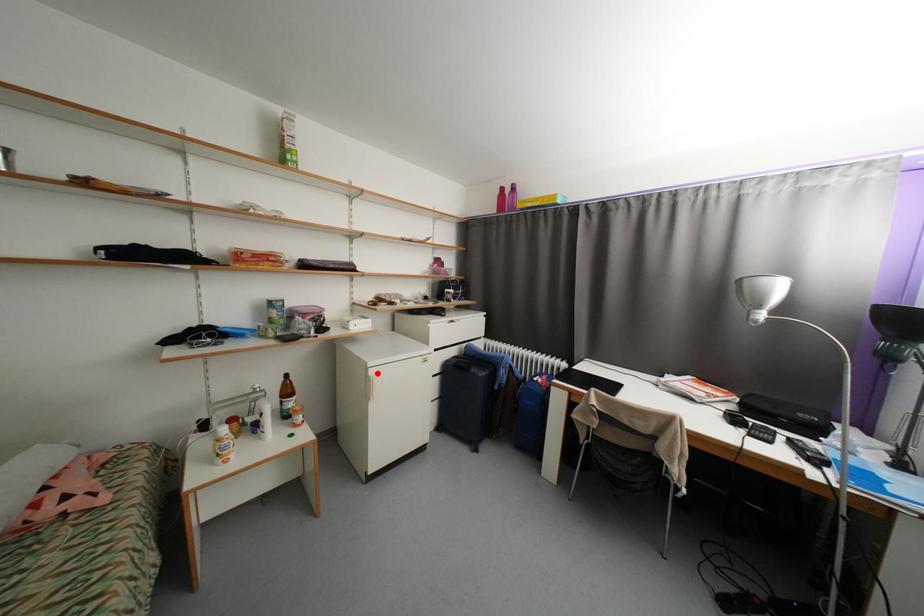
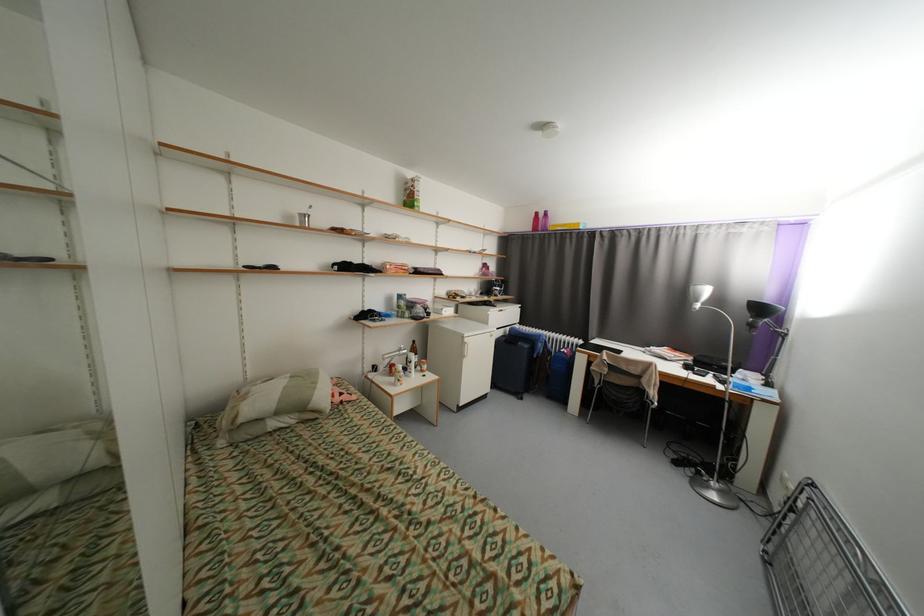
Question: I am providing you with two images of the same scene from different viewpoints. A red point is marked on the first image. Can you still see the location of the red point in image 2?

Choices:
 (A) Yes
 (B) No

Answer: (A)